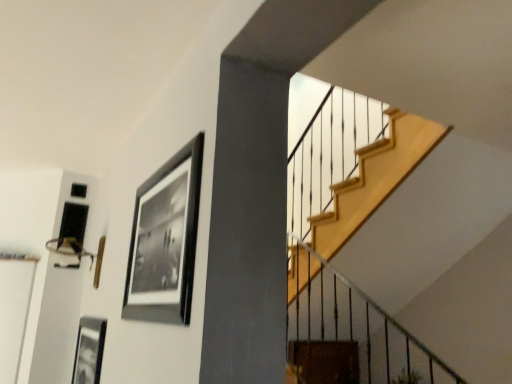
Question: Is black matte picture frame at upper left, which is the first picture frame from top to bottom, taller or shorter than black matte picture frame at lower left, placed as the 1th picture frame when sorted from left to right?

Choices:
 (A) short
 (B) tall

Answer: (B)

Question: Based on their sizes in the image, would you say black matte picture frame at upper left, which ranks as the second picture frame in bottom-to-top order, is bigger or smaller than black matte picture frame at lower left, arranged as the second picture frame when viewed from the top?

Choices:
 (A) big
 (B) small

Answer: (A)

Question: From a real-world perspective, is black matte picture frame at upper left, which ranks as the second picture frame in bottom-to-top order, positioned above or below black matte picture frame at lower left, placed as the 1th picture frame when sorted from left to right?

Choices:
 (A) above
 (B) below

Answer: (A)

Question: From a real-world perspective, is black matte picture frame at lower left, which ranks as the second picture frame in right-to-left order, physically located above or below black matte picture frame at upper left, which ranks as the second picture frame in bottom-to-top order?

Choices:
 (A) above
 (B) below

Answer: (B)

Question: Looking at their shapes, would you say black matte picture frame at lower left, arranged as the 1th picture frame when ordered from the bottom, is wider or thinner than black matte picture frame at upper left, which ranks as the second picture frame in bottom-to-top order?

Choices:
 (A) wide
 (B) thin

Answer: (B)

Question: Based on their sizes in the image, would you say black matte picture frame at lower left, arranged as the 1th picture frame when ordered from the bottom, is bigger or smaller than black matte picture frame at upper left, positioned as the 2th picture frame in left-to-right order?

Choices:
 (A) small
 (B) big

Answer: (A)

Question: In the image, is black matte picture frame at lower left, arranged as the second picture frame when viewed from the top, on the left side or the right side of black matte picture frame at upper left, which ranks as the second picture frame in bottom-to-top order?

Choices:
 (A) right
 (B) left

Answer: (B)